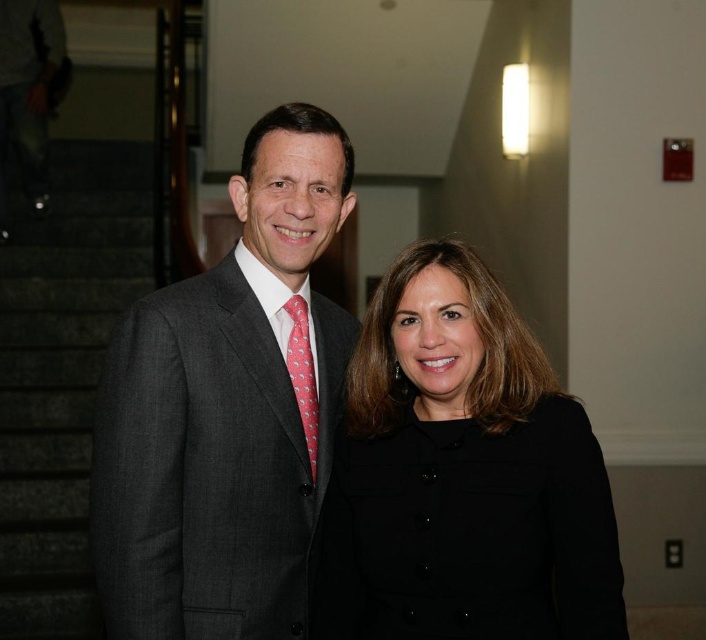
Question: Which of the following is the farthest from the observer?

Choices:
 (A) (382, 396)
 (B) (138, 460)

Answer: (A)

Question: Among these objects, which one is farthest from the camera?

Choices:
 (A) matte gray suit at center
 (B) black matte coat at center
 (C) pink silk tie at center

Answer: (C)

Question: Which object is positioned closest to the pink silk tie at center?

Choices:
 (A) matte gray suit at center
 (B) black matte coat at center

Answer: (A)

Question: Does matte gray suit at center appear on the right side of pink silk tie at center?

Choices:
 (A) no
 (B) yes

Answer: (A)

Question: Is black matte coat at center positioned at the back of pink silk tie at center?

Choices:
 (A) yes
 (B) no

Answer: (B)

Question: Is matte gray suit at center to the right of black matte coat at center from the viewer's perspective?

Choices:
 (A) yes
 (B) no

Answer: (B)